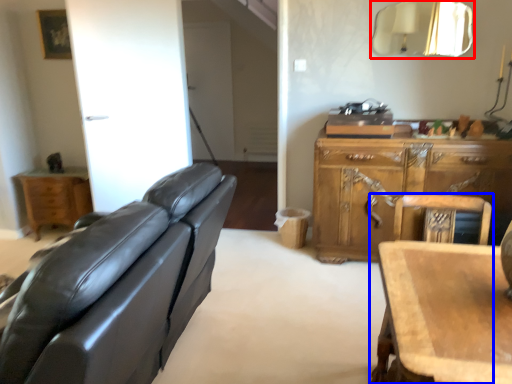
Question: Among these objects, which one is farthest to the camera, mirror (highlighted by a red box) or chair (highlighted by a blue box)?

Choices:
 (A) mirror
 (B) chair

Answer: (A)